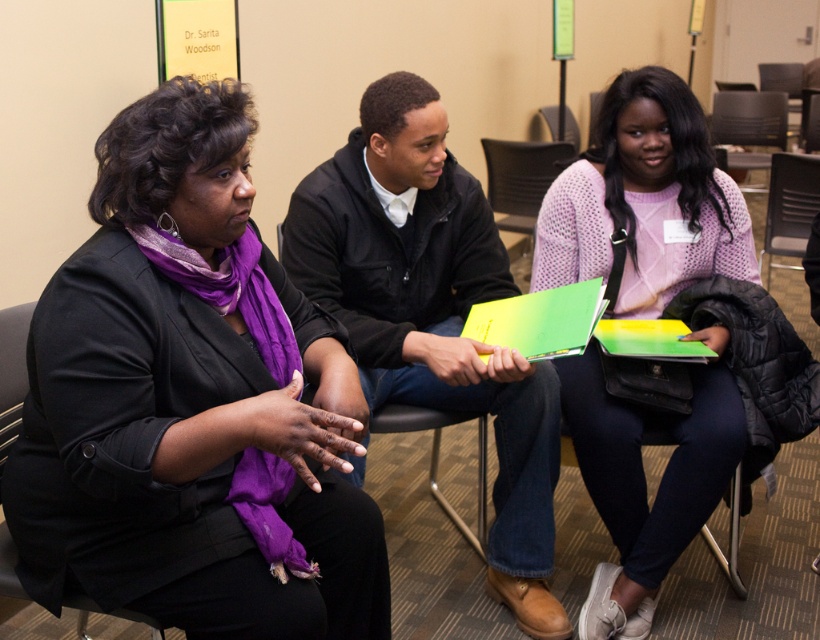
Can you confirm if purple scarf at center is positioned to the left of black matte jacket at center?

Yes, purple scarf at center is to the left of black matte jacket at center.

Which is behind, point (65, 474) or point (436, 257)?

The point (436, 257) is more distant.

Image resolution: width=820 pixels, height=640 pixels. Find the location of `purple scarf at center`. purple scarf at center is located at coordinates (190, 403).

Is matte black chair at center further to camera compared to black leather chair at center?

Yes, matte black chair at center is further from the viewer.

Which is in front, point (745, 156) or point (481, 509)?

Point (481, 509)

This screenshot has height=640, width=820. In order to click on matte black chair at center in this screenshot , I will do `click(749, 118)`.

Does pink knitted sweater at center have a greater width compared to black leather chair at center?

Yes, pink knitted sweater at center is wider than black leather chair at center.

Can you confirm if pink knitted sweater at center is thinner than black leather chair at center?

No, pink knitted sweater at center is not thinner than black leather chair at center.

Locate an element on the screen. The height and width of the screenshot is (640, 820). pink knitted sweater at center is located at coordinates (645, 202).